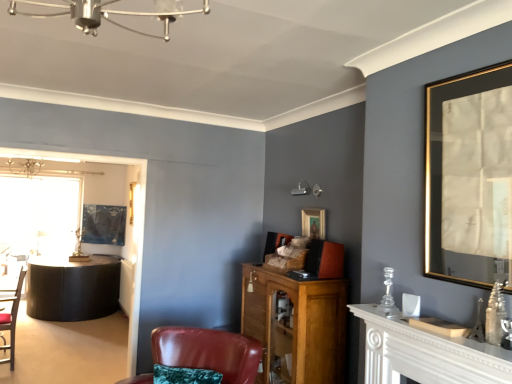
Question: From a real-world perspective, is transparent glass table at left physically located above or below wooden cabinet at center?

Choices:
 (A) above
 (B) below

Answer: (A)

Question: Does point (67, 236) appear closer or farther from the camera than point (265, 344)?

Choices:
 (A) closer
 (B) farther

Answer: (B)

Question: Which object is the closest to the transparent glass table at left?

Choices:
 (A) wooden picture frame at center, the 2th picture frame positioned from the front
 (B) matte black picture frame at center, marked as the 3th picture frame in a front-to-back arrangement
 (C) leather armchair at center, the first chair in the front-to-back sequence
 (D) matte black chair at left, placed as the 1th chair when sorted from left to right
 (E) white wooden mantelpiece at right

Answer: (B)

Question: Which object is the farthest from the transparent glass table at left?

Choices:
 (A) leather armchair at center, which is counted as the second chair, starting from the back
 (B) matte black picture frame at center, acting as the 3th picture frame starting from the right
 (C) white wooden mantelpiece at right
 (D) wooden cabinet at center
 (E) wooden picture frame at center, acting as the second picture frame starting from the back

Answer: (C)